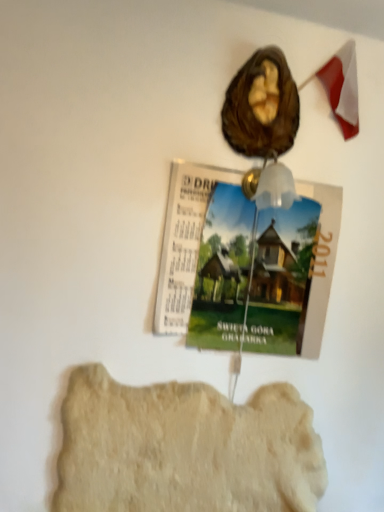
Question: Is green paper magazine at upper center situated inside brown matte walnut at upper center or outside?

Choices:
 (A) outside
 (B) inside

Answer: (A)

Question: Considering the positions of green paper magazine at upper center and brown matte walnut at upper center in the image, is green paper magazine at upper center wider or thinner than brown matte walnut at upper center?

Choices:
 (A) thin
 (B) wide

Answer: (A)

Question: Which object is the closest to the light beige stone at lower center?

Choices:
 (A) brown matte walnut at upper center
 (B) green paper magazine at upper center

Answer: (B)

Question: Which object is positioned farthest from the green paper magazine at upper center?

Choices:
 (A) light beige stone at lower center
 (B) brown matte walnut at upper center

Answer: (A)